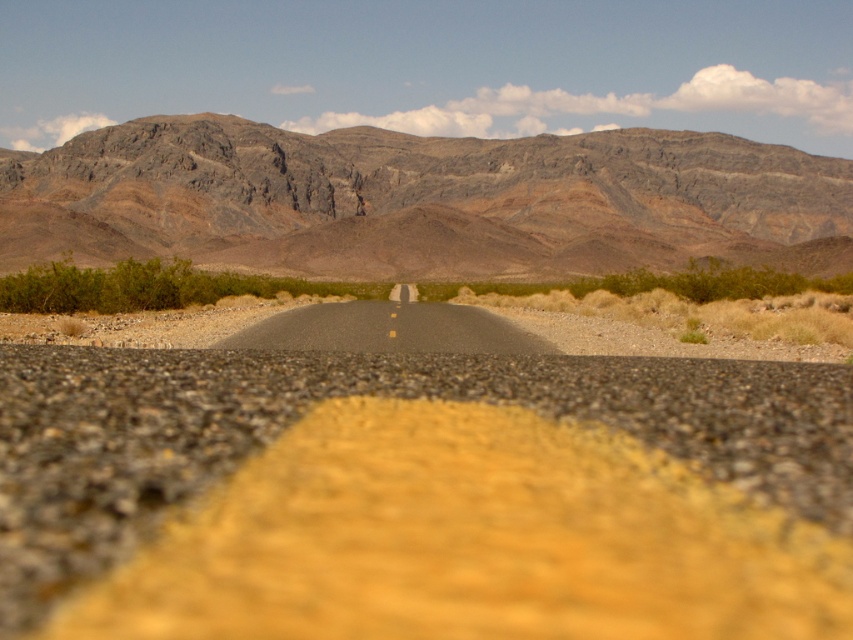
You are standing at the edge of the smooth asphalt road at center and want to cross it to reach the other side. The road is 1.40 meters wide. If you walk straight across, will you be able to cross safely without stepping off the road?

The smooth asphalt road at center is 1.40 meters wide. Since you are walking straight across, you can safely cross without stepping off the road as the width is sufficient for a person to traverse.

You are standing on the road and looking towards the mountains. There are two points marked on the road ahead of you. The first point is at coordinates point [616,592] and the second point is at coordinates point [219,157]. Which point is closer to you?

Point [616,592] is closer to the viewer than point [219,157].

You are driving a car and see the smooth asphalt road at center and the rugged rock mountain at center ahead. Which one is positioned more to the left from your perspective?

The smooth asphalt road at center is positioned more to the left than the rugged rock mountain at center.